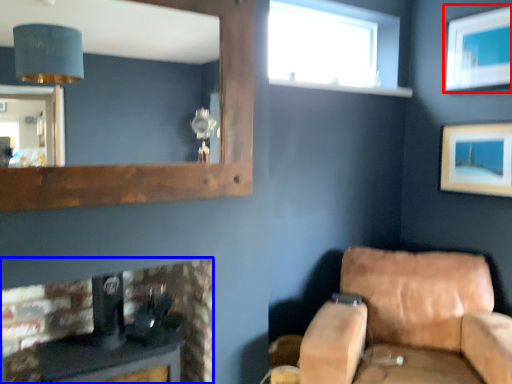
Question: Among these objects, which one is farthest to the camera, picture frame (highlighted by a red box) or furniture (highlighted by a blue box)?

Choices:
 (A) picture frame
 (B) furniture

Answer: (A)